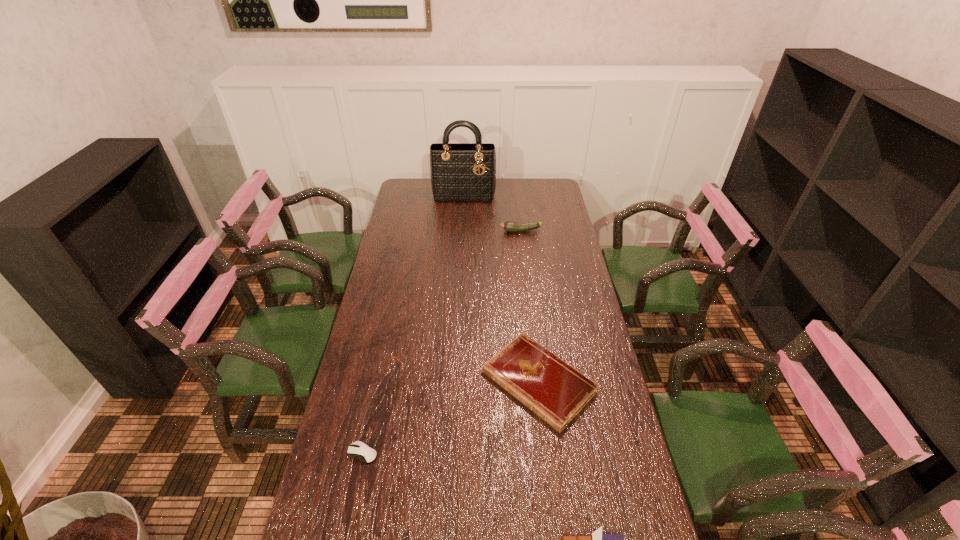
This screenshot has width=960, height=540. Find the location of `vacant point at the far right corner`. vacant point at the far right corner is located at coordinates (541, 183).

At what (x,y) coordinates should I click in order to perform the action: click on free point between the fourth nearest object and the fourth farthest object. Please return your answer as a coordinate pair (x, y). The image size is (960, 540). Looking at the image, I should click on [442, 342].

Identify the location of vacant region between the zucchini and the fourth farthest object. This screenshot has width=960, height=540. (442, 342).

Where is `blank region between the second tallest object and the tallest object`? blank region between the second tallest object and the tallest object is located at coordinates (492, 213).

Find the location of a particular element. This screenshot has width=960, height=540. object that stands as the closest to the third farthest object is located at coordinates (597, 539).

Choose which object is the second nearest neighbor to the notebook. Please provide its 2D coordinates. Your answer should be formatted as a tuple, i.e. [(x, y)], where the tuple contains the x and y coordinates of a point satisfying the conditions above.

[(358, 449)]

Locate an element on the screen. Image resolution: width=960 pixels, height=540 pixels. vacant space that satisfies the following two spatial constraints: 1. on the back side of the third farthest object; 2. on the right side of the fourth farthest object is located at coordinates (377, 382).